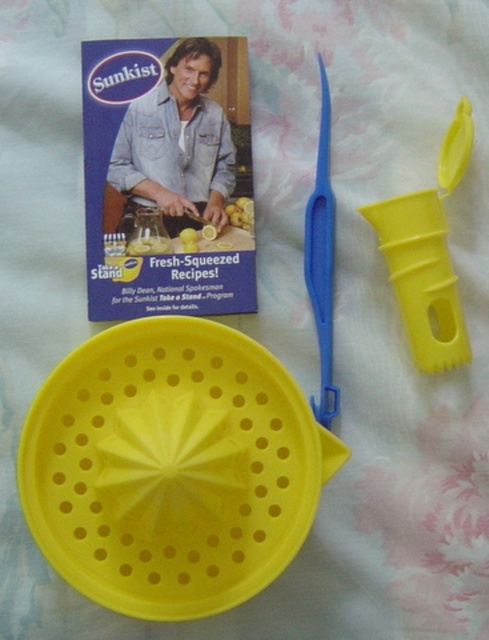
Question: Is yellow matte strainer at center smaller than yellow plastic juicer at right?

Choices:
 (A) no
 (B) yes

Answer: (A)

Question: Can you confirm if yellow plastic juicer at right is smaller than blue plastic scissors at upper center?

Choices:
 (A) no
 (B) yes

Answer: (A)

Question: Does yellow matte strainer at center appear over yellow plastic juicer at right?

Choices:
 (A) no
 (B) yes

Answer: (A)

Question: Which point is farther from the camera taking this photo?

Choices:
 (A) (75, 476)
 (B) (453, 301)

Answer: (B)

Question: Which is farther from the blue plastic scissors at upper center?

Choices:
 (A) yellow plastic juicer at right
 (B) yellow matte strainer at center

Answer: (B)

Question: Considering the real-world distances, which object is farthest from the yellow matte strainer at center?

Choices:
 (A) blue plastic scissors at upper center
 (B) yellow plastic juicer at right

Answer: (B)